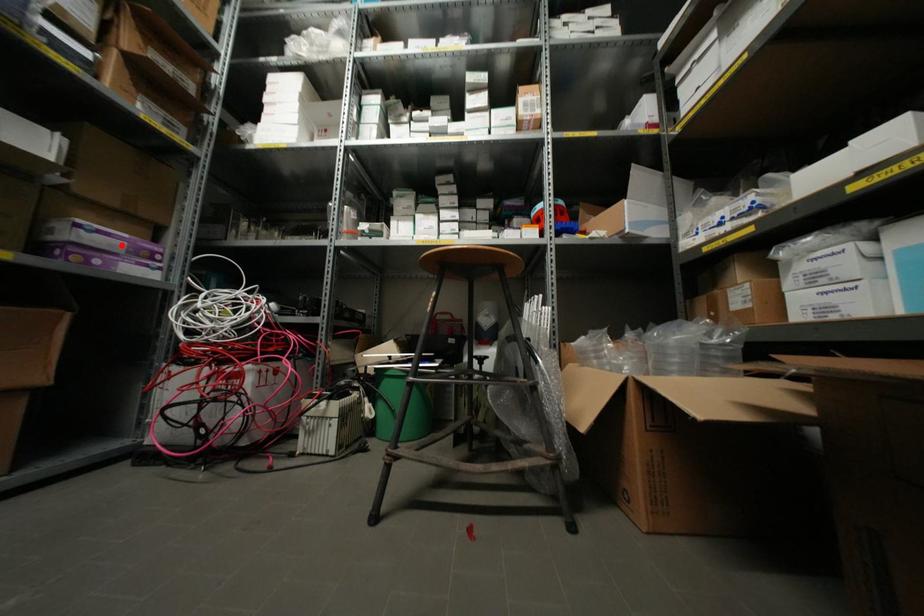
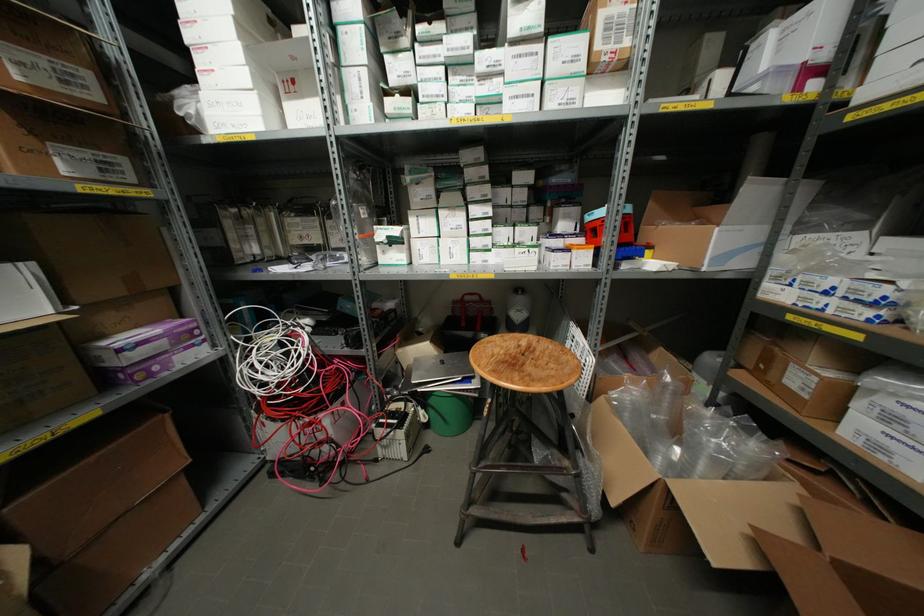
The point at the highlighted location is marked in the first image. Where is the corresponding point in the second image?

(163, 342)